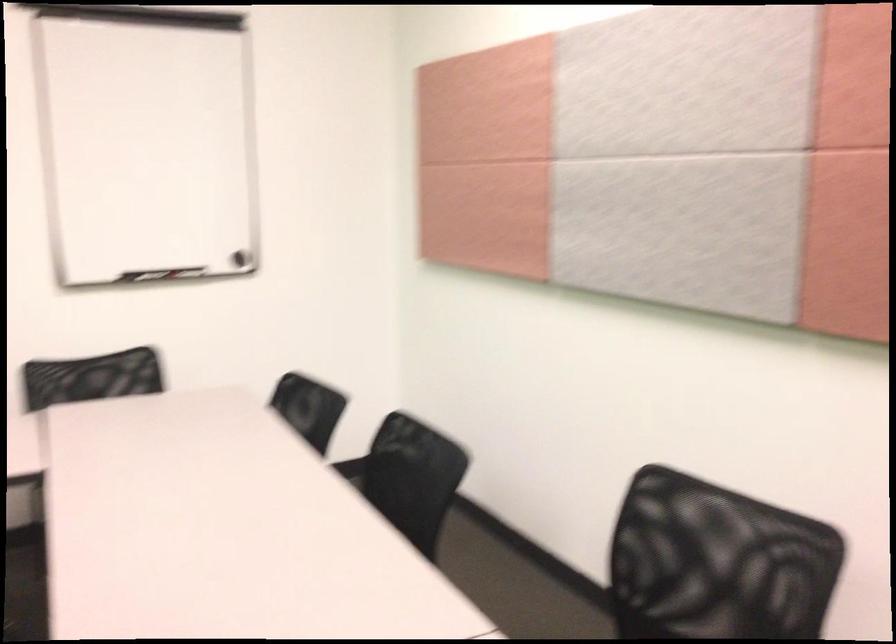
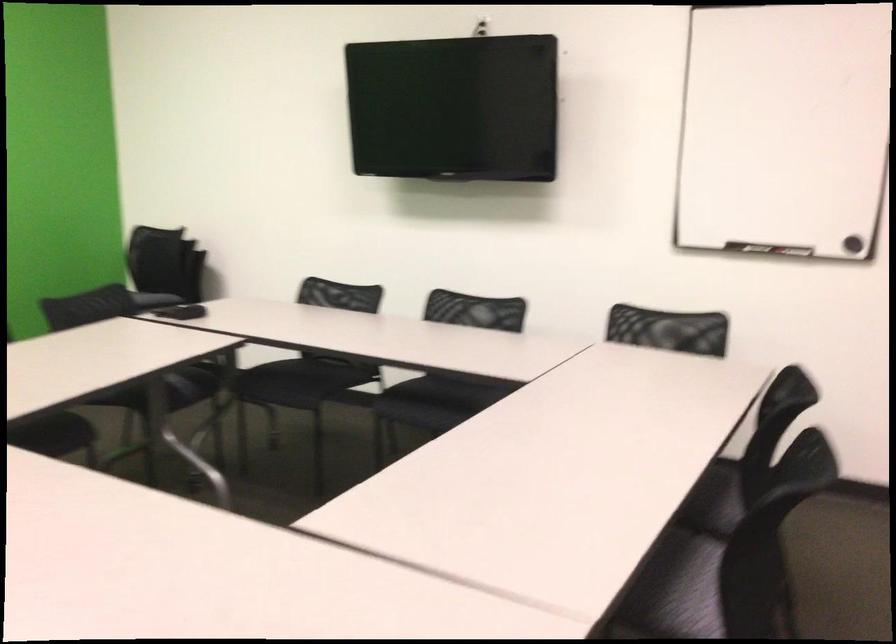
Question: The images are taken continuously from a first-person perspective. In which direction is your viewpoint rotating?

Choices:
 (A) Left
 (B) Right
 (C) Up
 (D) Down

Answer: (A)